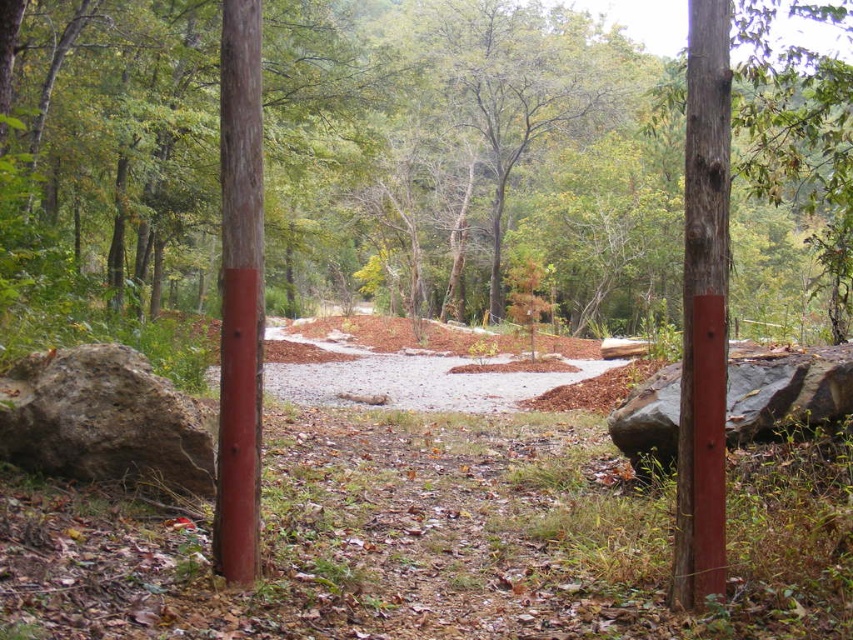
Question: Can you confirm if smooth bark tree at center is positioned to the right of gray rough rock at lower left?

Choices:
 (A) yes
 (B) no

Answer: (A)

Question: Is gray rough rock at lower left above smooth wood post at center?

Choices:
 (A) yes
 (B) no

Answer: (A)

Question: Considering the real-world distances, which object is farthest from the smooth wood post at center?

Choices:
 (A) gray rough rock at lower left
 (B) wooden post at center
 (C) smooth bark tree at center
 (D) smooth gray rock at center

Answer: (C)

Question: Is gray rough rock at lower left smaller than smooth gray rock at center?

Choices:
 (A) yes
 (B) no

Answer: (A)

Question: Estimate the real-world distances between objects in this image. Which object is farther from the smooth bark tree at center?

Choices:
 (A) wooden post at center
 (B) smooth wood post at center
 (C) smooth gray rock at center

Answer: (B)

Question: Estimate the real-world distances between objects in this image. Which object is farther from the smooth bark tree at center?

Choices:
 (A) wooden post at center
 (B) smooth gray rock at center
 (C) smooth wood post at center

Answer: (C)